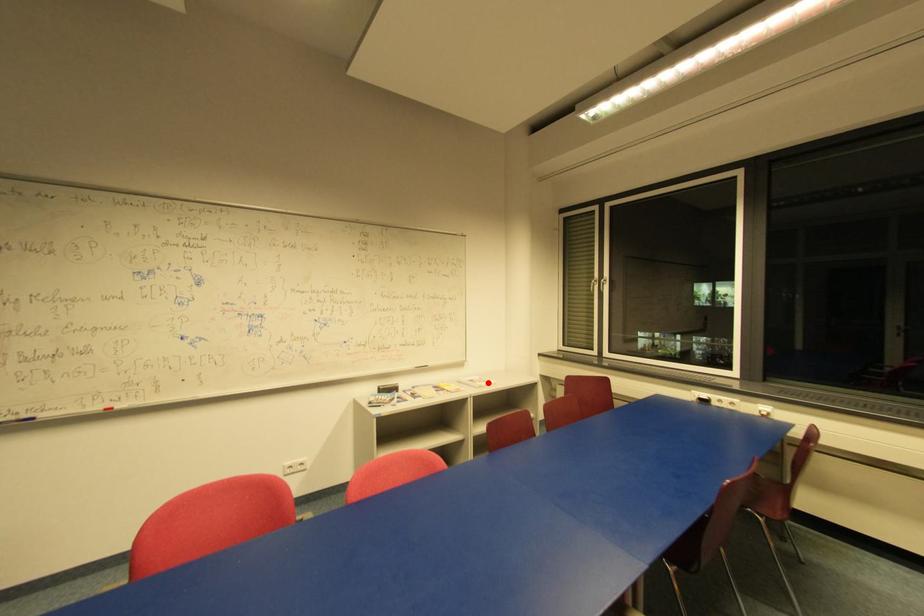
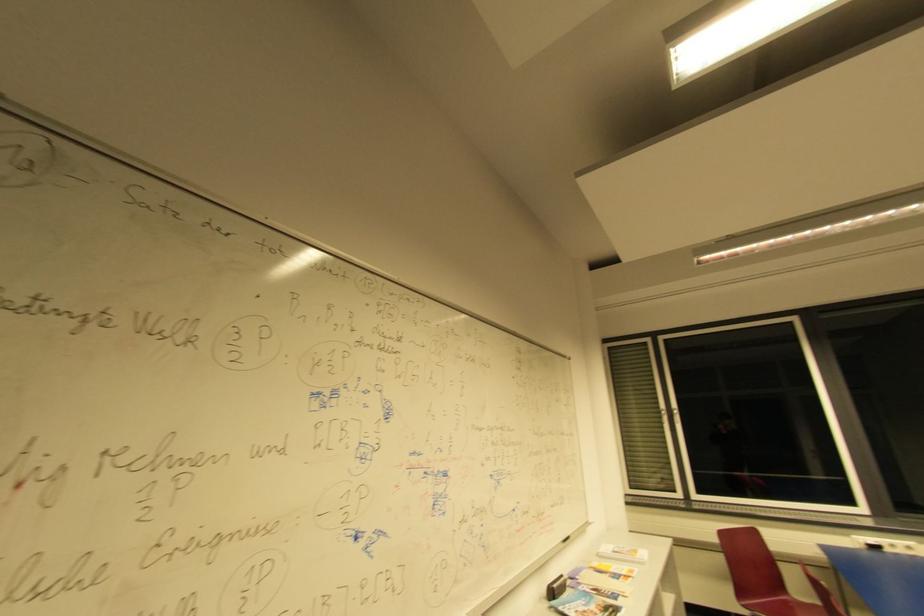
Locate, in the second image, the point that corresponds to the highlighted location in the first image.

(640, 553)